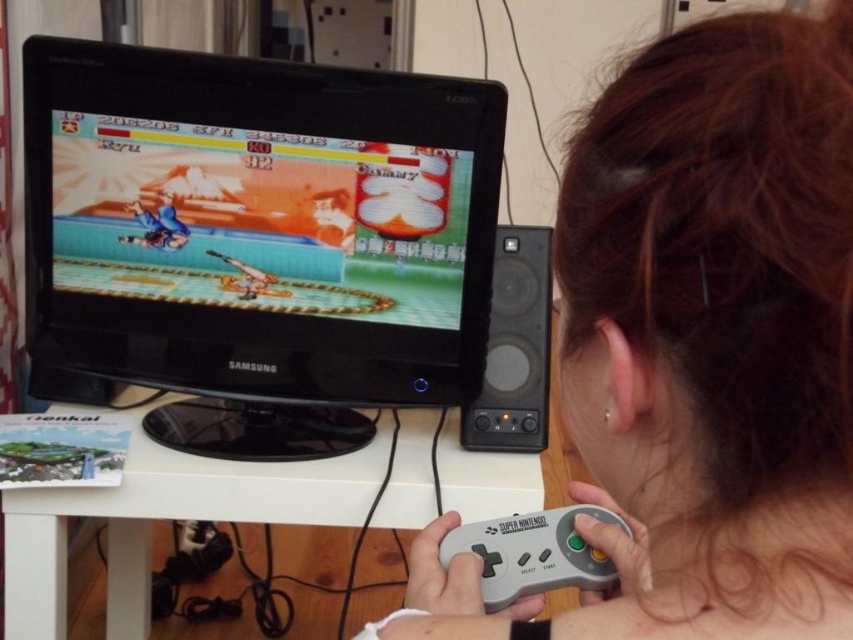
You are trying to reach for the gray matte game controller at lower center while sitting at the desk. Based on the scene, where should you look first to locate it relative to the matte black monitor at center?

The gray matte game controller at lower center is located below the matte black monitor at center, so you should look downward from the monitor to find it.

You are a delivery person who needs to place a new controller on the desk. The new controller is 8 inches long. There is already a gray matte controller at lower center and a gray matte game controller at lower center. Can you fit the new controller between them without moving the existing ones?

The gray matte controller at lower center is 7.54 inches away from the gray matte game controller at lower center. Since the new controller is 8 inches long, it cannot fit between them as the space is smaller than the controller.